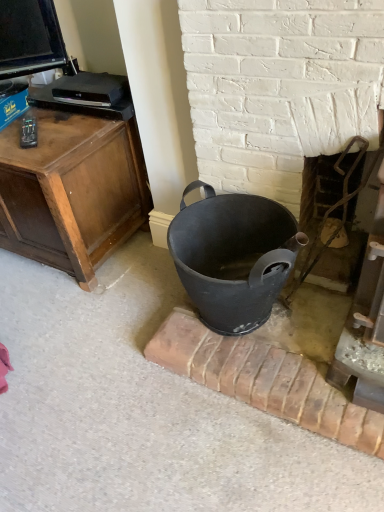
Question: From a real-world perspective, is matte black bucket at center, the first fireplace when ordered from left to right, over matte black trash can at center?

Choices:
 (A) yes
 (B) no

Answer: (A)

Question: Does matte black bucket at center, the first fireplace when ordered from left to right, have a larger size compared to matte black trash can at center?

Choices:
 (A) no
 (B) yes

Answer: (A)

Question: Does matte black bucket at center, placed as the 2th fireplace when sorted from right to left, appear on the left side of matte black trash can at center?

Choices:
 (A) yes
 (B) no

Answer: (B)

Question: Is matte black bucket at center, placed as the 2th fireplace when sorted from right to left, next to matte black trash can at center and touching it?

Choices:
 (A) yes
 (B) no

Answer: (B)

Question: Is matte black bucket at center, placed as the 2th fireplace when sorted from right to left, further to camera compared to matte black trash can at center?

Choices:
 (A) yes
 (B) no

Answer: (B)

Question: Is matte black bucket at center, the first fireplace when ordered from left to right, positioned beyond the bounds of matte black trash can at center?

Choices:
 (A) yes
 (B) no

Answer: (A)

Question: Are matte black trash can at center and matte black bucket at center, placed as the 2th fireplace when sorted from right to left, located far from each other?

Choices:
 (A) no
 (B) yes

Answer: (A)

Question: From the image's perspective, is matte black trash can at center on matte black bucket at center, placed as the 2th fireplace when sorted from right to left?

Choices:
 (A) no
 (B) yes

Answer: (A)

Question: Can you confirm if matte black trash can at center is positioned to the left of matte black bucket at center, placed as the 2th fireplace when sorted from right to left?

Choices:
 (A) yes
 (B) no

Answer: (A)

Question: Considering the relative sizes of matte black trash can at center and matte black bucket at center, placed as the 2th fireplace when sorted from right to left, in the image provided, is matte black trash can at center smaller than matte black bucket at center, placed as the 2th fireplace when sorted from right to left,?

Choices:
 (A) no
 (B) yes

Answer: (A)

Question: Is matte black trash can at center oriented away from matte black bucket at center, the first fireplace when ordered from left to right?

Choices:
 (A) no
 (B) yes

Answer: (B)

Question: Is the depth of matte black trash can at center greater than that of matte black bucket at center, placed as the 2th fireplace when sorted from right to left?

Choices:
 (A) yes
 (B) no

Answer: (A)

Question: Is the surface of rustic metal fireplace at right, positioned as the second fireplace in left-to-right order, in direct contact with matte black trash can at center?

Choices:
 (A) no
 (B) yes

Answer: (A)